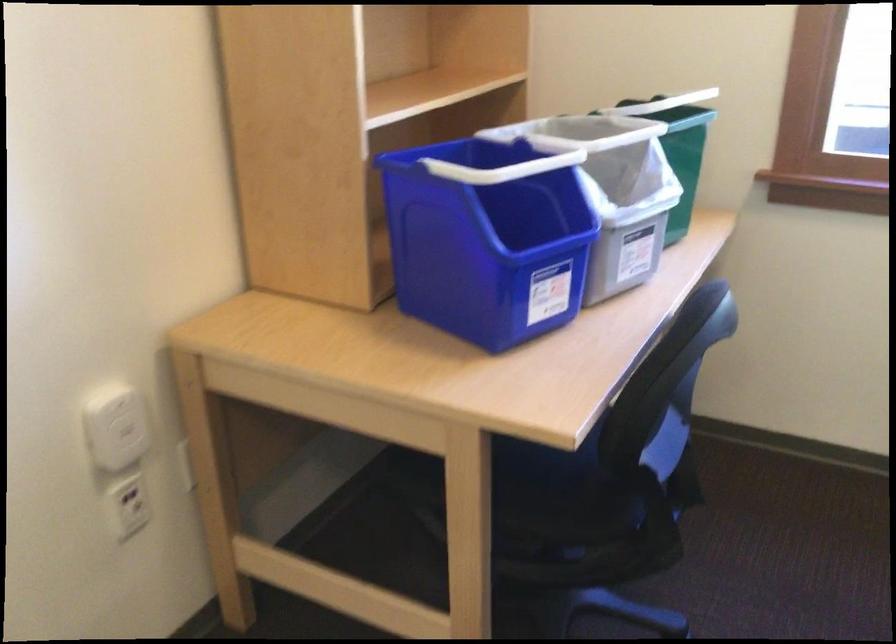
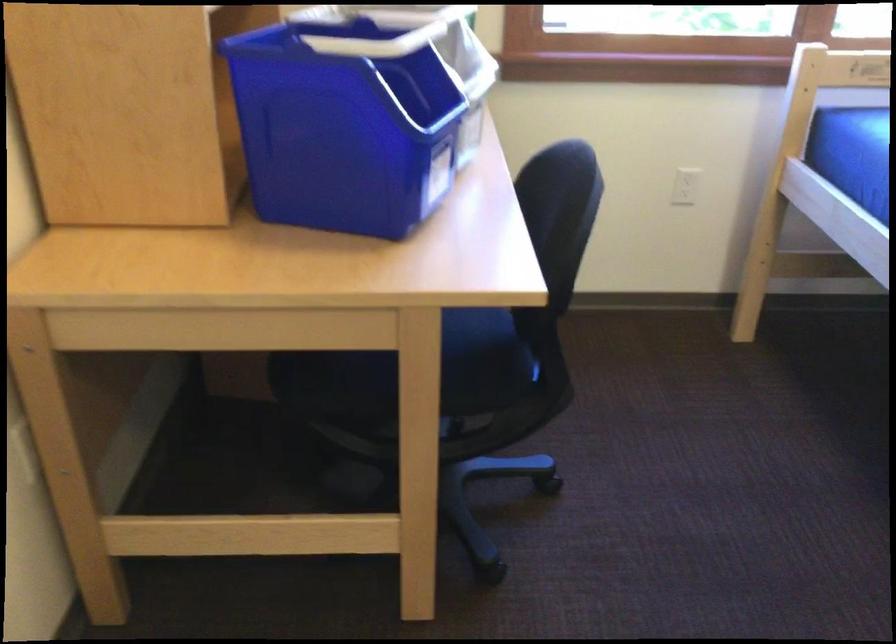
Locate, in the second image, the point that corresponds to the point at 458,491 in the first image.

(409, 384)